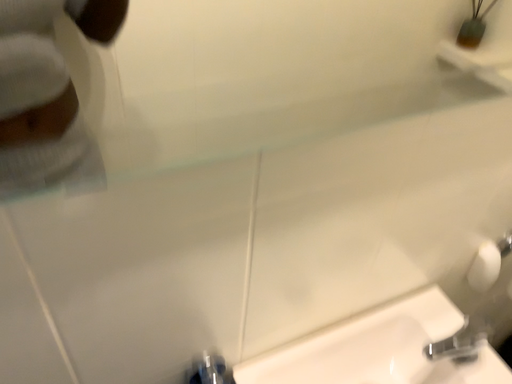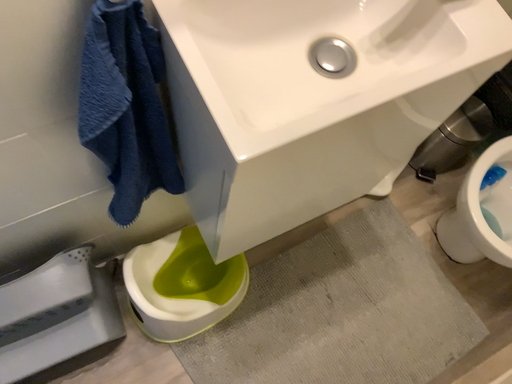
Question: Which way did the camera rotate in the video?

Choices:
 (A) rotated upward
 (B) rotated downward

Answer: (B)